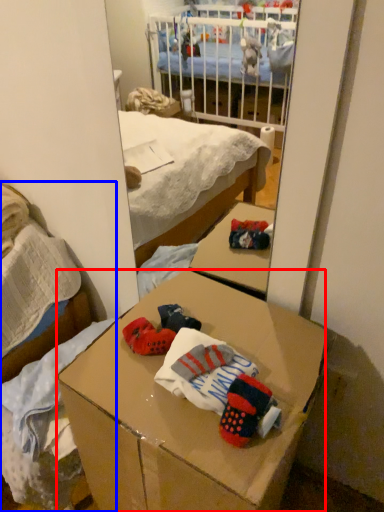
Question: Which object is further to the camera taking this photo, desk (highlighted by a red box) or bed (highlighted by a blue box)?

Choices:
 (A) desk
 (B) bed

Answer: (B)